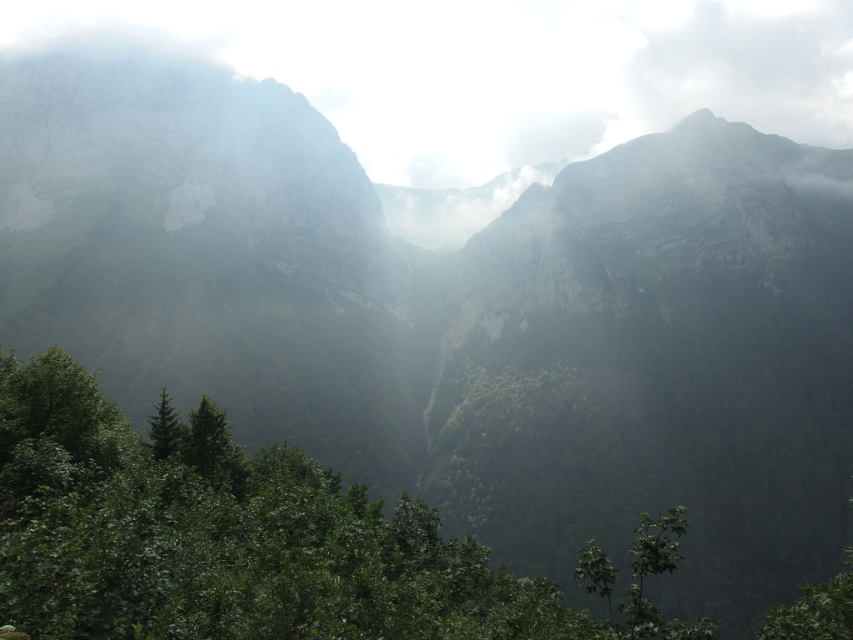
Does green leafy tree at center have a larger size compared to green leafy tree at lower center?

Correct, green leafy tree at center is larger in size than green leafy tree at lower center.

Who is lower down, green leafy tree at center or green leafy tree at lower center?

green leafy tree at center is below.

Does point (363, 545) come farther from viewer compared to point (209, 481)?

No, (363, 545) is in front of (209, 481).

Identify the location of green leafy tree at center. Image resolution: width=853 pixels, height=640 pixels. (234, 541).

Can you confirm if green leafy tree at center is positioned to the left of green matte tree at center?

Incorrect, green leafy tree at center is not on the left side of green matte tree at center.

Which is below, green leafy tree at center or green matte tree at center?

Positioned lower is green leafy tree at center.

Is point (73, 502) positioned after point (160, 452)?

No, (73, 502) is in front of (160, 452).

This screenshot has height=640, width=853. What are the coordinates of `green leafy tree at center` in the screenshot? It's located at (234, 541).

Does point (212, 412) come closer to viewer compared to point (177, 429)?

No.

Which is more to the right, green leafy tree at lower center or green matte tree at center?

green leafy tree at lower center is more to the right.

Is point (192, 428) positioned in front of point (172, 449)?

That is False.

Identify the location of green leafy tree at lower center. (212, 449).